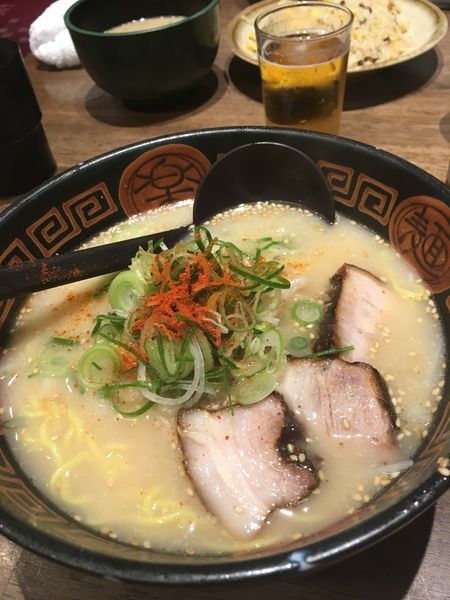
This screenshot has width=450, height=600. In order to click on black bowl in this screenshot , I will do `click(374, 186)`, `click(2, 500)`.